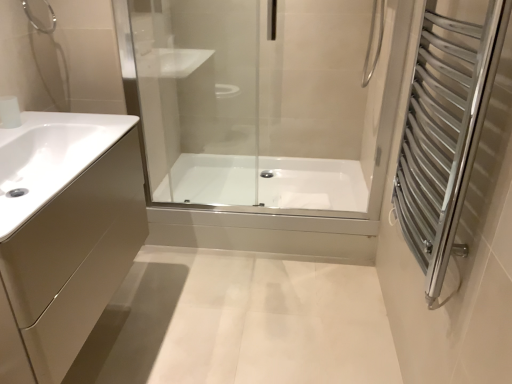
Question: Is silver metallic towel rack at right behind brushed metal shower at upper left?

Choices:
 (A) yes
 (B) no

Answer: (B)

Question: Is silver metallic towel rack at right smaller than brushed metal shower at upper left?

Choices:
 (A) yes
 (B) no

Answer: (B)

Question: Considering the relative sizes of silver metallic towel rack at right and brushed metal shower at upper left in the image provided, is silver metallic towel rack at right shorter than brushed metal shower at upper left?

Choices:
 (A) no
 (B) yes

Answer: (A)

Question: Is brushed metal shower at upper left a part of silver metallic towel rack at right?

Choices:
 (A) no
 (B) yes

Answer: (A)

Question: From a real-world perspective, is silver metallic towel rack at right positioned over brushed metal shower at upper left based on gravity?

Choices:
 (A) yes
 (B) no

Answer: (B)

Question: Considering the relative sizes of silver metallic towel rack at right and brushed metal shower at upper left in the image provided, is silver metallic towel rack at right bigger than brushed metal shower at upper left?

Choices:
 (A) yes
 (B) no

Answer: (A)

Question: Is matte beige cabinet at left at the right side of white glossy sink at left?

Choices:
 (A) yes
 (B) no

Answer: (B)

Question: Is matte beige cabinet at left oriented towards white glossy sink at left?

Choices:
 (A) no
 (B) yes

Answer: (A)

Question: Is white glossy sink at left at the back of matte beige cabinet at left?

Choices:
 (A) no
 (B) yes

Answer: (A)

Question: Is matte beige cabinet at left surrounding white glossy sink at left?

Choices:
 (A) no
 (B) yes

Answer: (B)

Question: Is matte beige cabinet at left far from white glossy sink at left?

Choices:
 (A) yes
 (B) no

Answer: (B)

Question: From a real-world perspective, is matte beige cabinet at left physically below white glossy sink at left?

Choices:
 (A) yes
 (B) no

Answer: (A)

Question: Does white glossy faucet at upper left appear on the right side of white glossy sink at left?

Choices:
 (A) yes
 (B) no

Answer: (B)